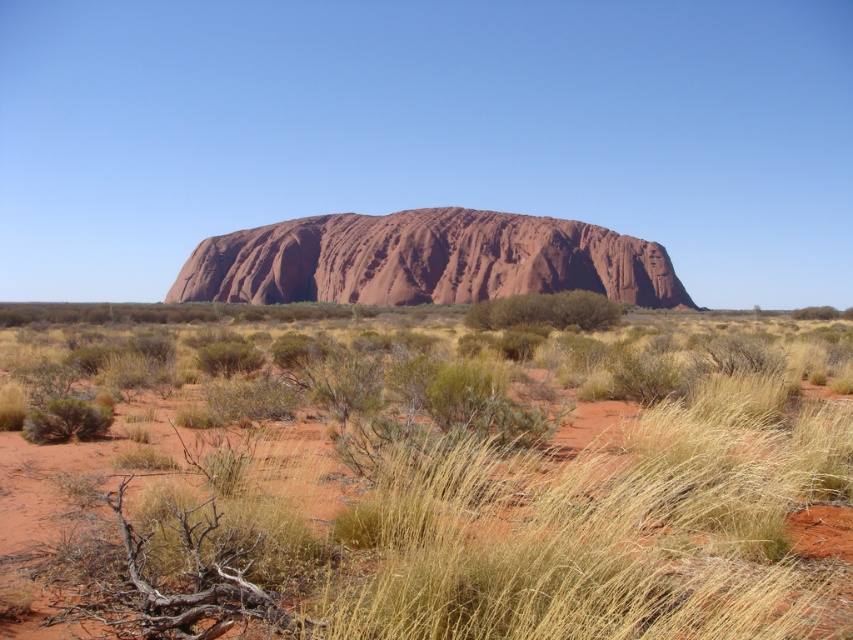
You are standing at the point closest to the desert landscape in the image. Which of the two points, point (581, 240) or point (584, 323), is farther away from you?

Point (581, 240) is behind point (584, 323), so it is farther away from you.

You are a hiker planning to cross the desert and need to identify the shortest vegetation to step on. Which one between the yellow dry grass at center and the green shrub at center should you choose?

The yellow dry grass at center is not as tall as the green shrub at center, so you should choose the yellow dry grass at center as it is shorter and easier to step on.